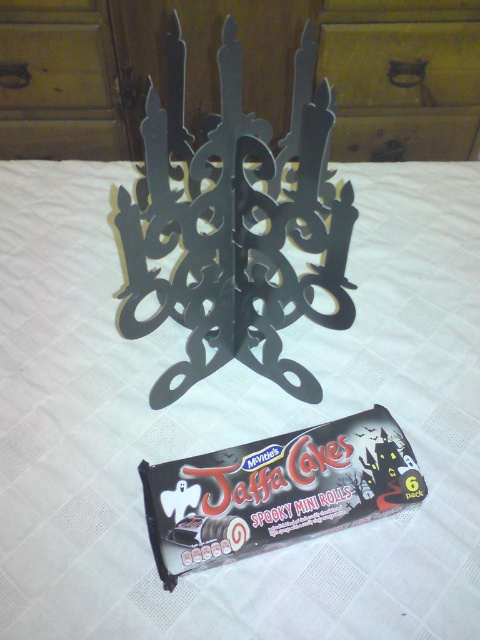
Looking at this image, you have a small toy car that is 4 inches long. You want to move it from the matte black candelabra at center to the brushed metal drawer at upper center. Can the toy car fit in the space between them without moving either object?

The distance between the matte black candelabra at center and the brushed metal drawer at upper center is 3.98 inches. Since the toy car is 4 inches long, it cannot fit in the space between them without moving either object.

You are standing in front of the image and want to place a small object exactly at the location marked by the point (x=242, y=72). What object will this point land on?

The point (x=242, y=72) marks the matte black candelabra at center, so placing the object there would land it on the candelabra.